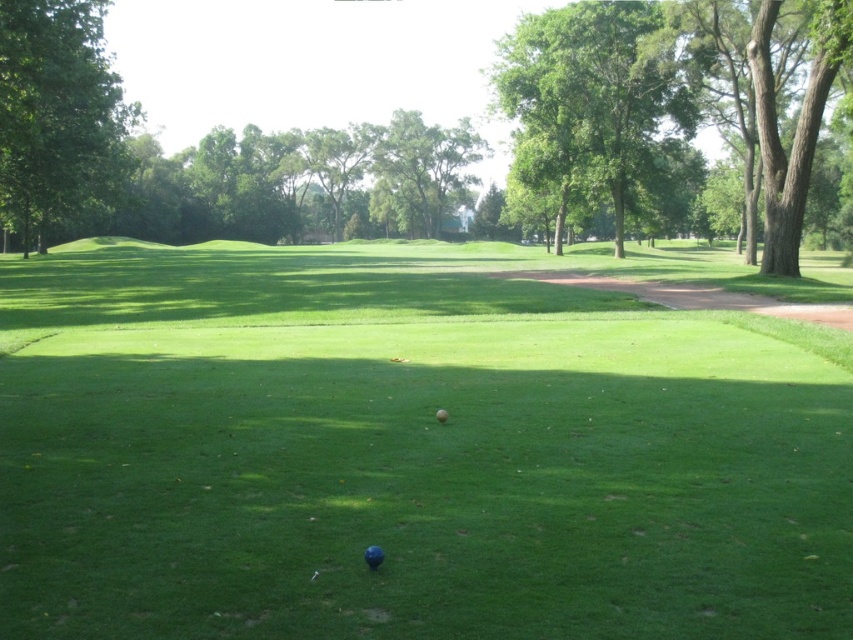
You are a golfer who wants to hit the blue rubber golf ball at center. Since the green grass at center is in the way, can you still hit the ball without the grass affecting your shot?

The green grass at center is larger in size than the blue rubber golf ball at center, so it might block the path, making it difficult to hit the ball cleanly.

You are standing at the point marked by the coordinates point (415, 445). What is the terrain like at your current location?

The terrain at point (415, 445) is green grass at center.